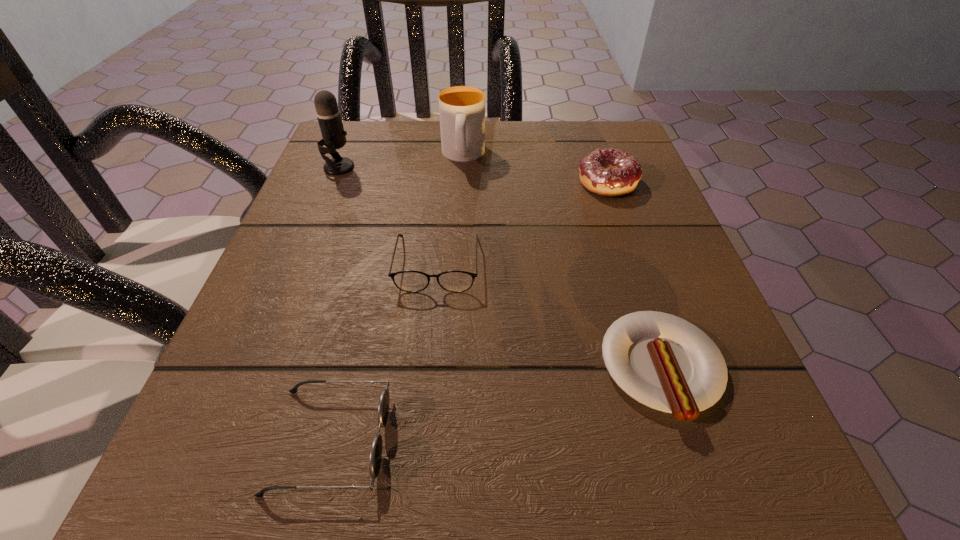
Locate which object is the fifth closest to the doughnut. Please provide its 2D coordinates. Your answer should be formatted as a tuple, i.e. [(x, y)], where the tuple contains the x and y coordinates of a point satisfying the conditions above.

[(375, 458)]

What are the coordinates of `the third closest object to the sunglasses` in the screenshot? It's located at (328, 114).

Where is `free point that satisfies the following two spatial constraints: 1. with the handle on the side of the fifth shortest object; 2. on the front-facing side of the sunglasses`? This screenshot has height=540, width=960. free point that satisfies the following two spatial constraints: 1. with the handle on the side of the fifth shortest object; 2. on the front-facing side of the sunglasses is located at coordinates (448, 440).

At what (x,y) coordinates should I click in order to perform the action: click on vacant space that satisfies the following two spatial constraints: 1. with the handle on the side of the second tallest object; 2. on the right side of the doughnut. Please return your answer as a coordinate pair (x, y). This screenshot has width=960, height=540. Looking at the image, I should click on (462, 183).

At what (x,y) coordinates should I click in order to perform the action: click on free space that satisfies the following two spatial constraints: 1. on the front-facing side of the sausage; 2. on the right side of the spectacles. Please return your answer as a coordinate pair (x, y). The width and height of the screenshot is (960, 540). Looking at the image, I should click on (427, 369).